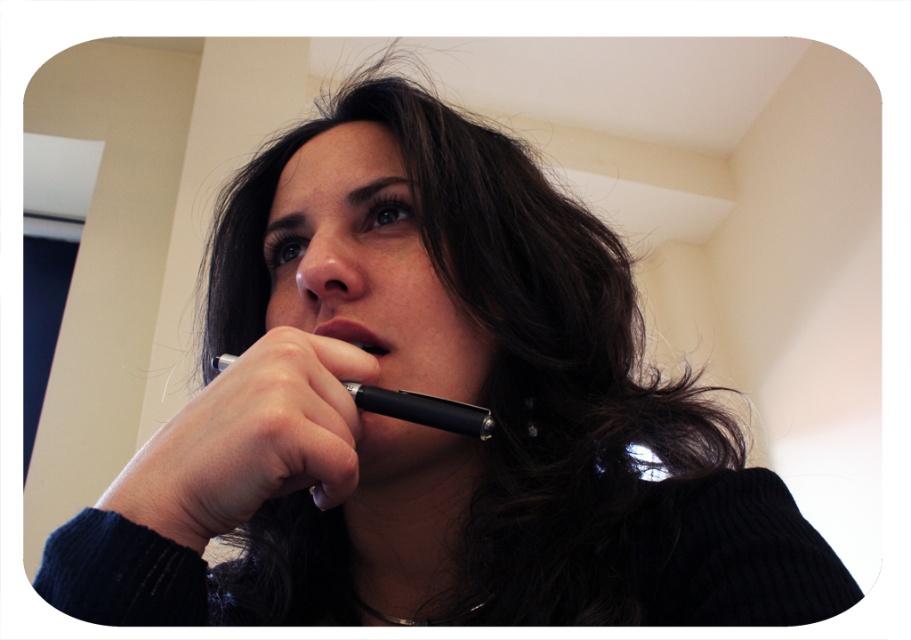
You are a photographer adjusting your camera settings. You notice the matte black nose at center in your frame. Based on its position at coordinates, will the nose be in focus if your camera is focused at point 0.408, 0.357?

Yes, the matte black nose at center is located exactly at the point (324, 260), so if the camera is focused there, the nose will be in focus.

Based on the scene description, can you determine if the matte black nose at center is wider than the pink matte lips at center?

The matte black nose at center is wider than the pink matte lips at center according to the objects description.